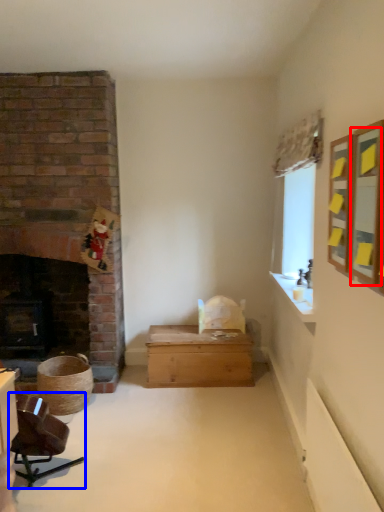
Question: Which of the following is the farthest to the observer, mirror (highlighted by a red box) or chair (highlighted by a blue box)?

Choices:
 (A) mirror
 (B) chair

Answer: (B)